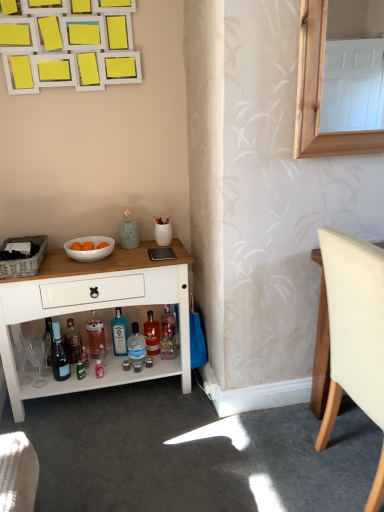
This screenshot has height=512, width=384. I want to click on vacant area that is situated to the right of matte black picnic basket at left, so click(66, 265).